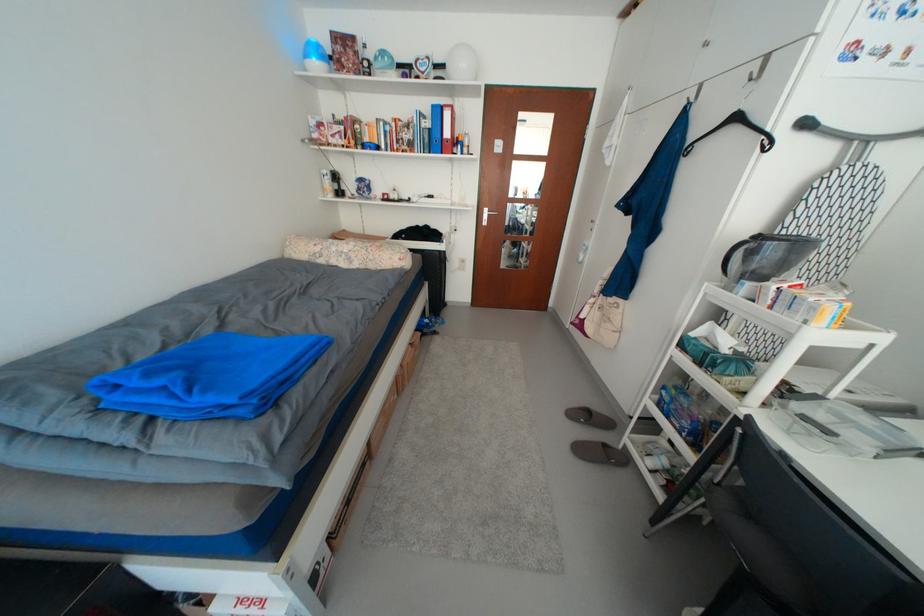
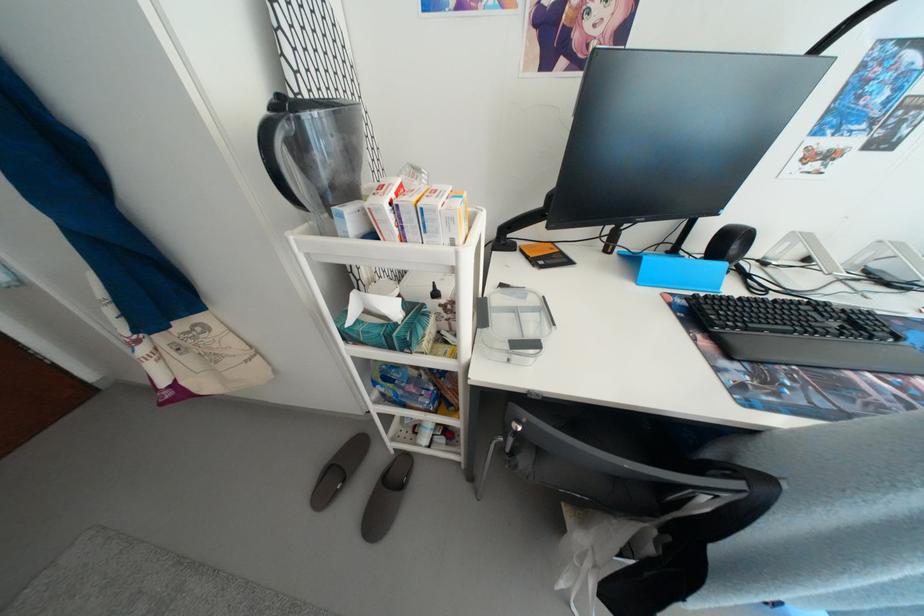
Based on the continuous images, in which direction is the camera rotating?

The camera rotated toward right-down.